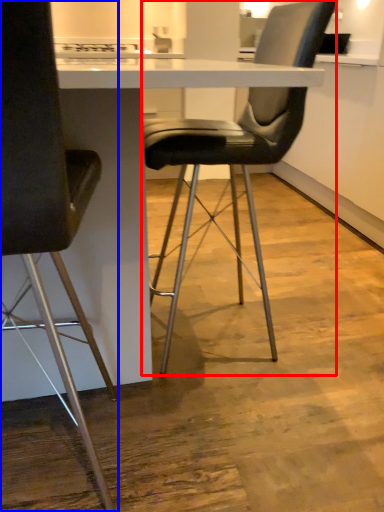
Question: Which object is closer to the camera taking this photo, chair (highlighted by a red box) or chair (highlighted by a blue box)?

Choices:
 (A) chair
 (B) chair

Answer: (B)